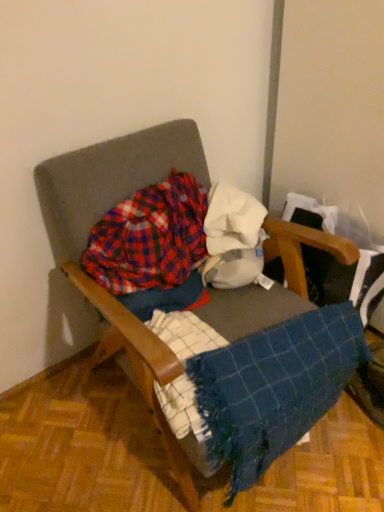
The height and width of the screenshot is (512, 384). Find the location of `vacant region below blue woven blanket at lower right (from a real-world perspective)`. vacant region below blue woven blanket at lower right (from a real-world perspective) is located at coordinates (303, 457).